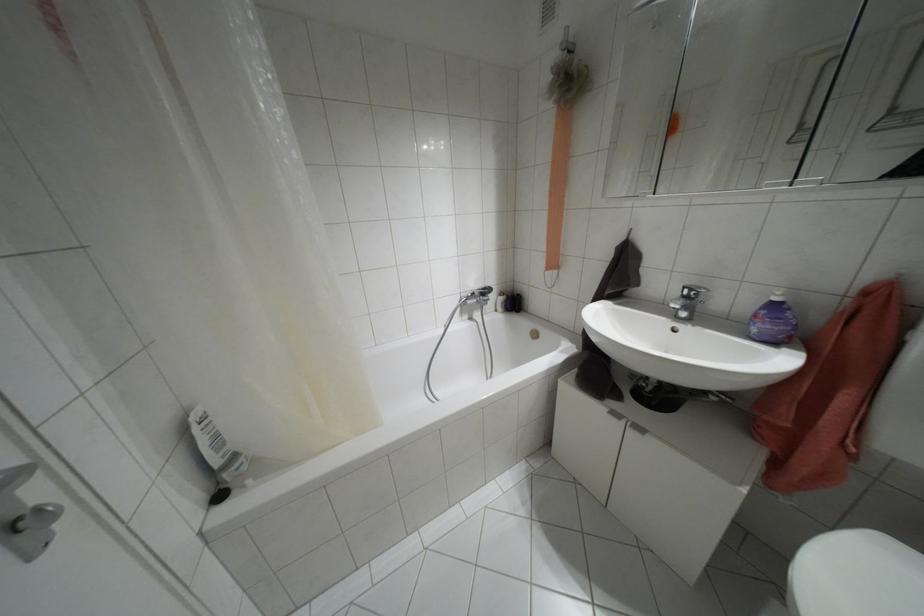
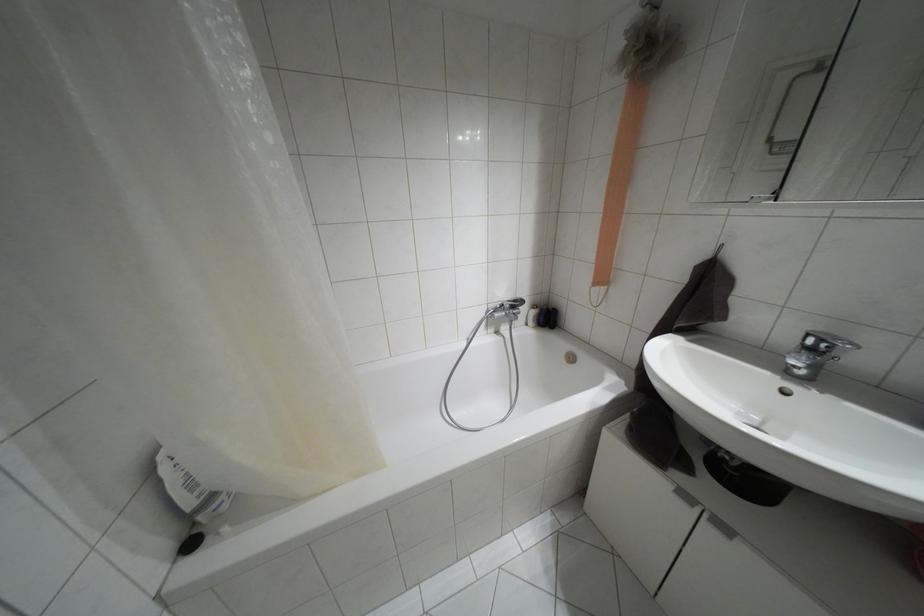
Find the pixel in the second image that matches point 234,456 in the first image.

(212, 496)